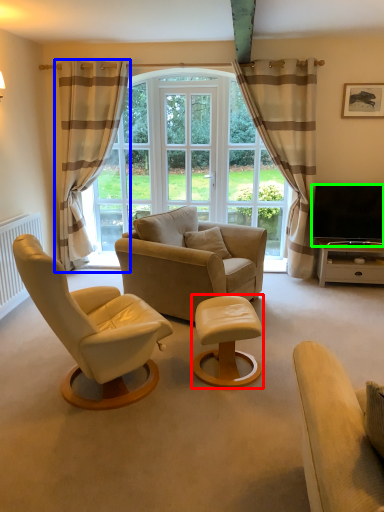
Question: Which object is the farthest from table (highlighted by a red box)? Choose among these: curtain (highlighted by a blue box) or television (highlighted by a green box).

Choices:
 (A) curtain
 (B) television

Answer: (A)